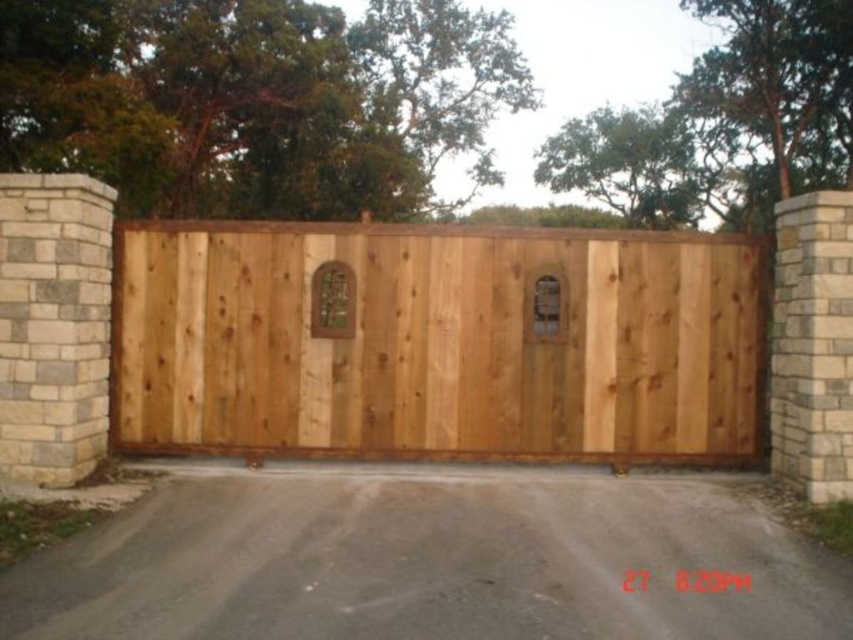
Question: Which of the following is the farthest from the observer?

Choices:
 (A) (561, 326)
 (B) (283, 237)

Answer: (A)

Question: Can you confirm if natural wood gate at center is positioned below natural wood door at center?

Choices:
 (A) no
 (B) yes

Answer: (B)

Question: Is natural wood gate at center bigger than gray concrete driveway at center?

Choices:
 (A) yes
 (B) no

Answer: (B)

Question: Which object is closer to the camera taking this photo?

Choices:
 (A) gray concrete driveway at center
 (B) natural wood door at center

Answer: (A)

Question: Among these points, which one is farthest from the camera?

Choices:
 (A) (587, 349)
 (B) (561, 416)

Answer: (A)

Question: Does natural wood gate at center appear on the right side of natural wood door at center?

Choices:
 (A) yes
 (B) no

Answer: (A)